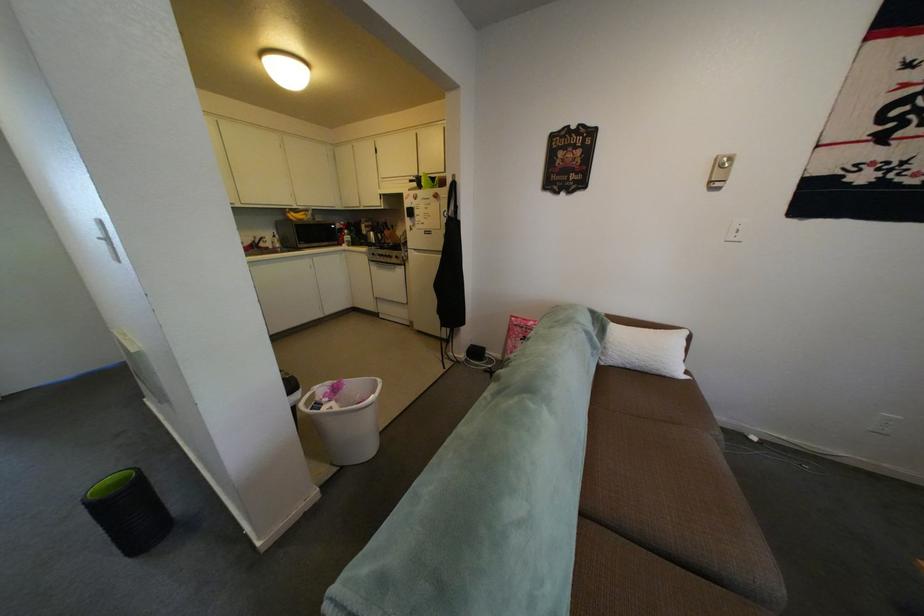
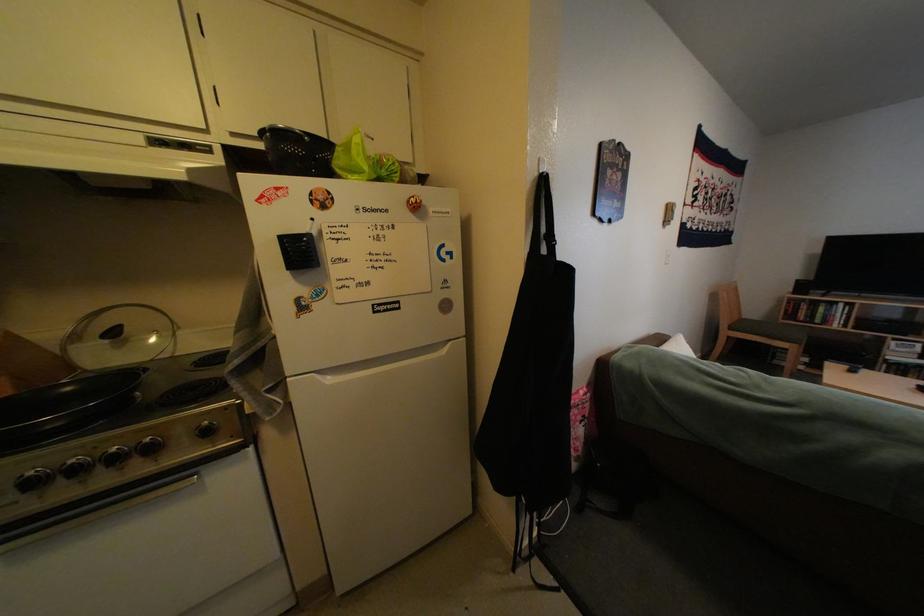
In the second image, find the point that corresponds to (394,254) in the first image.

(45, 475)